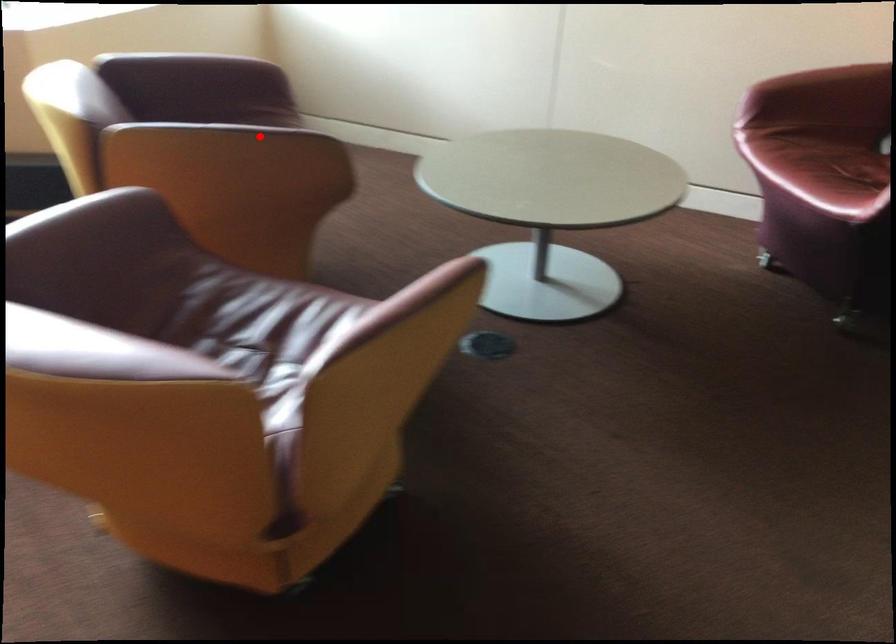
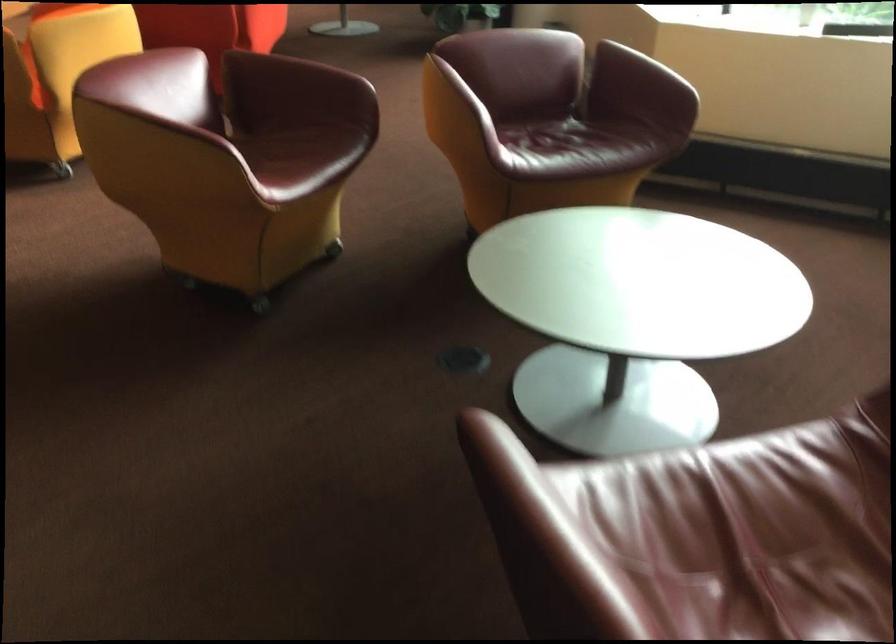
The point at the highlighted location is marked in the first image. Where is the corresponding point in the second image?

(463, 91)